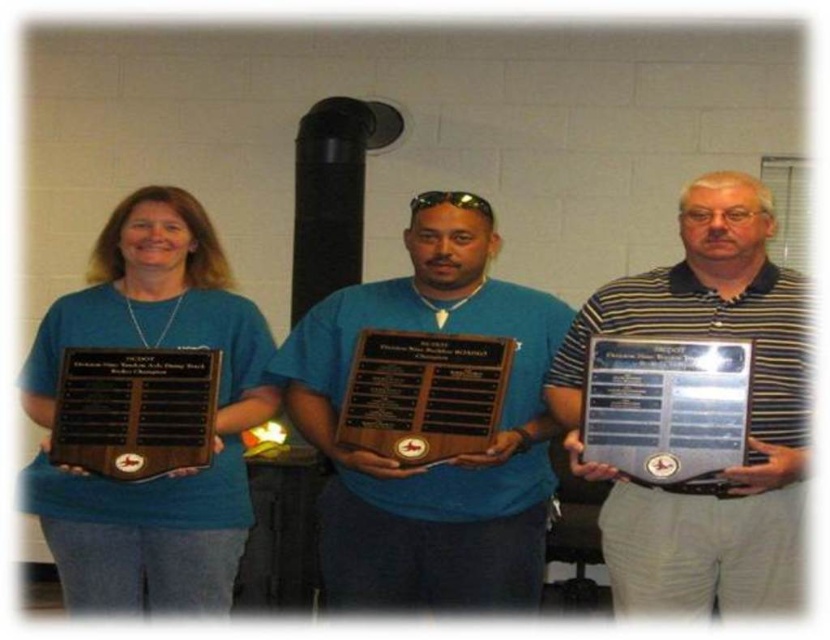
You are organizing a display and need to place the matte black plaque at left and the black polished wood plaque at left on a shelf. Which plaque should you place first if you want to start with the larger one?

You should place the matte black plaque at left first because it is larger than the black polished wood plaque at left according to the description.

You are a photographer positioned in front of the three people. You want to take a photo of the matte wood plaque at center and the matte black plaque at left. Which plaque will appear larger in the photo?

The matte wood plaque at center will appear larger in the photo because it is closer to the photographer than the matte black plaque at left.